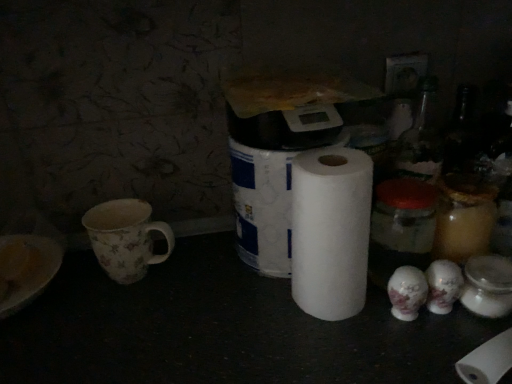
Question: From the image's perspective, is white matte toilet paper at center positioned above or below white matte paper towel at center?

Choices:
 (A) above
 (B) below

Answer: (A)

Question: Considering the relative positions of white matte toilet paper at center and white matte paper towel at center in the image provided, is white matte toilet paper at center to the left or to the right of white matte paper towel at center?

Choices:
 (A) left
 (B) right

Answer: (A)

Question: Which of these objects is positioned farthest from the white matte toilet paper at center?

Choices:
 (A) floral-patterned ceramic mug at left
 (B) white matte paper towel at center

Answer: (A)

Question: Estimate the real-world distances between objects in this image. Which object is farther from the white matte paper towel at center?

Choices:
 (A) floral-patterned ceramic mug at left
 (B) white matte toilet paper at center

Answer: (A)